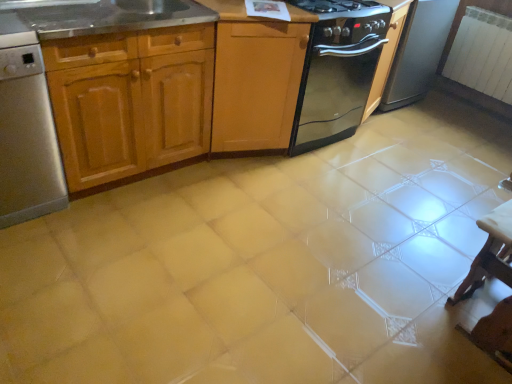
Question: Would you say stainless steel sink at upper left is to the left or to the right of black glass gas stove at upper center in the picture?

Choices:
 (A) left
 (B) right

Answer: (A)

Question: Based on their sizes in the image, would you say stainless steel sink at upper left is bigger or smaller than black glass gas stove at upper center?

Choices:
 (A) big
 (B) small

Answer: (A)

Question: Based on their relative distances, which object is farther from the white glossy table at lower right?

Choices:
 (A) black glossy oven at upper right
 (B) black glass gas stove at upper center
 (C) light wood cabinet at center, which is the 1th cabinetry from right to left
 (D) stainless steel dishwasher at left
 (E) wooden cabinet at left, the first cabinetry in the left-to-right sequence

Answer: (D)

Question: Which object is the closest to the stainless steel sink at upper left?

Choices:
 (A) black glossy oven at upper right
 (B) light wood cabinet at center, which is the second cabinetry in left-to-right order
 (C) stainless steel dishwasher at left
 (D) white glossy table at lower right
 (E) black glass gas stove at upper center

Answer: (C)